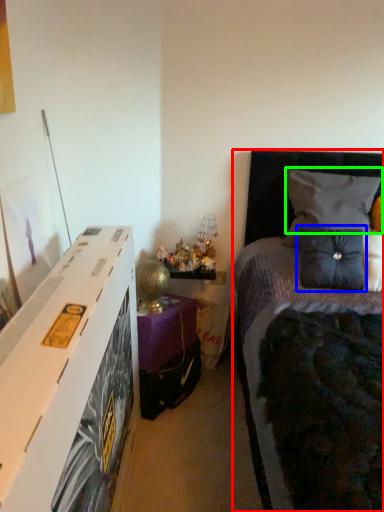
Question: Based on their relative distances, which object is farther from bed (highlighted by a red box)? Choose from pillow (highlighted by a blue box) and pillow (highlighted by a green box).

Choices:
 (A) pillow
 (B) pillow

Answer: (A)